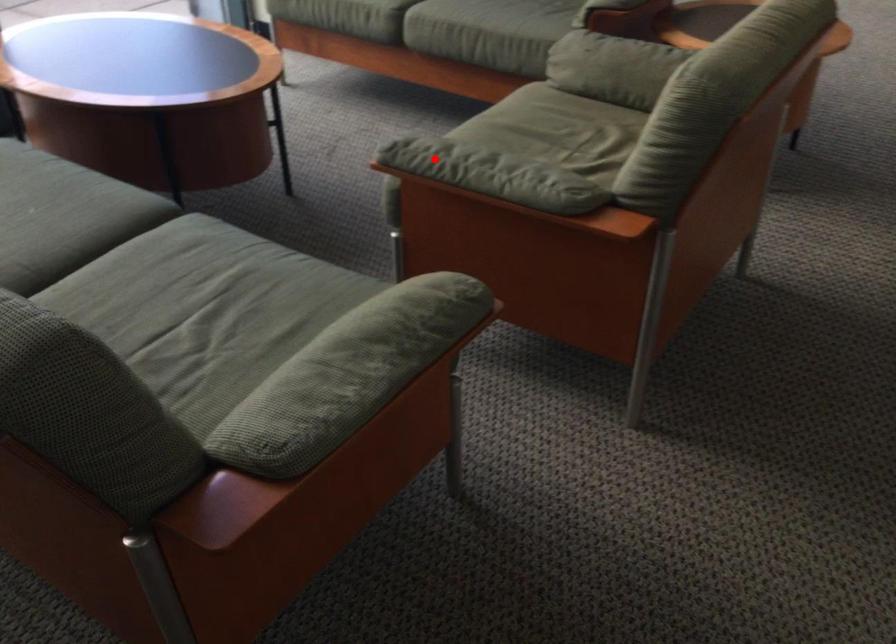
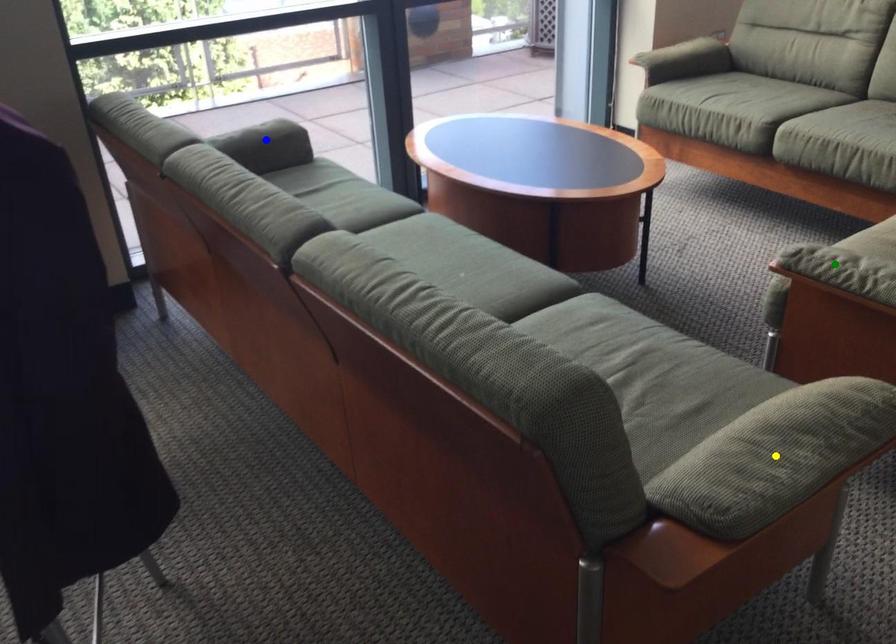
Question: I am providing you with two images of the same scene from different viewpoints. A red point is marked on the first image. You are given multiple points on the second image. Which point in image 2 represents the same 3d spot as the red point in image 1?

Choices:
 (A) green point
 (B) yellow point
 (C) blue point

Answer: (A)